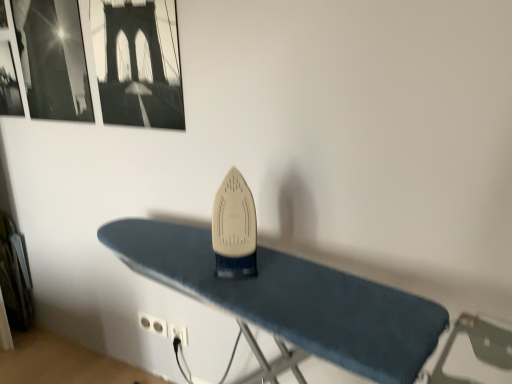
What do you see at coordinates (153, 324) in the screenshot?
I see `white plastic plug at lower center, marked as the 1th plug in a left-to-right arrangement` at bounding box center [153, 324].

At what (x,y) coordinates should I click in order to perform the action: click on white plastic plug at lower center, marked as the 1th plug in a left-to-right arrangement. Please return your answer as a coordinate pair (x, y). Looking at the image, I should click on (153, 324).

Locate an element on the screen. The image size is (512, 384). white plastic plug at lower center, marked as the 1th plug in a left-to-right arrangement is located at coordinates (153, 324).

From a real-world perspective, does black paper picture frame at upper left, arranged as the 2th picture frame when viewed from the left, stand above white plastic plug at lower center, marked as the 1th plug in a left-to-right arrangement?

Yes, from a real-world perspective, black paper picture frame at upper left, arranged as the 2th picture frame when viewed from the left, is over white plastic plug at lower center, marked as the 1th plug in a left-to-right arrangement

Which object is thinner, black paper picture frame at upper left, positioned as the 1th picture frame in right-to-left order, or white plastic plug at lower center, marked as the 1th plug in a left-to-right arrangement?

white plastic plug at lower center, marked as the 1th plug in a left-to-right arrangement.

Which object is more forward, black paper picture frame at upper left, arranged as the 2th picture frame when viewed from the left, or white plastic plug at lower center, the 2th plug viewed from the right?

black paper picture frame at upper left, arranged as the 2th picture frame when viewed from the left, is closer to the camera.

Can you tell me how much black paper picture frame at upper left, positioned as the 1th picture frame in right-to-left order, and white plastic plug at lower center, the 2th plug viewed from the right, differ in facing direction?

The angle between the facing direction of black paper picture frame at upper left, positioned as the 1th picture frame in right-to-left order, and the facing direction of white plastic plug at lower center, the 2th plug viewed from the right, is 0.00662 degrees.

Locate an element on the screen. The width and height of the screenshot is (512, 384). the 2nd picture frame to the left of the black plastic plug at lower center, which is the first plug in right-to-left order, starting your count from the anchor is located at coordinates (53, 59).

In terms of height, does black plastic plug at lower center, which is counted as the 2th plug, starting from the left, look taller or shorter compared to black glossy picture frame at upper left, the first picture frame when ordered from left to right?

Considering their sizes, black plastic plug at lower center, which is counted as the 2th plug, starting from the left, has less height than black glossy picture frame at upper left, the first picture frame when ordered from left to right.

From a real-world perspective, which object stands above the other?

black glossy picture frame at upper left, arranged as the 2th picture frame when viewed from the right, from a real-world perspective.

From the image's perspective, between black glossy picture frame at upper left, the first picture frame when ordered from left to right, and white plastic plug at lower center, marked as the 1th plug in a left-to-right arrangement, which one is located above?

black glossy picture frame at upper left, the first picture frame when ordered from left to right, is shown above in the image.

Which is more to the right, black glossy picture frame at upper left, arranged as the 2th picture frame when viewed from the right, or white plastic plug at lower center, marked as the 1th plug in a left-to-right arrangement?

Positioned to the right is white plastic plug at lower center, marked as the 1th plug in a left-to-right arrangement.

Between black glossy picture frame at upper left, the first picture frame when ordered from left to right, and white plastic plug at lower center, the 2th plug viewed from the right, which one has larger width?

black glossy picture frame at upper left, the first picture frame when ordered from left to right, is wider.

From a real-world perspective, which plug is the 2nd one underneath the black glossy picture frame at upper left, arranged as the 2th picture frame when viewed from the right? Please provide its 2D coordinates.

[(153, 324)]

Does white plastic plug at lower center, marked as the 1th plug in a left-to-right arrangement, have a larger size compared to white plastic iron at center?

No, white plastic plug at lower center, marked as the 1th plug in a left-to-right arrangement, is not bigger than white plastic iron at center.

Does white plastic plug at lower center, the 2th plug viewed from the right, touch white plastic iron at center?

white plastic plug at lower center, the 2th plug viewed from the right, and white plastic iron at center are clearly separated.

Which of these two, white plastic plug at lower center, marked as the 1th plug in a left-to-right arrangement, or white plastic iron at center, stands shorter?

white plastic plug at lower center, marked as the 1th plug in a left-to-right arrangement, is shorter.

Is white plastic plug at lower center, the 2th plug viewed from the right, in front of or behind white plastic iron at center in the image?

white plastic plug at lower center, the 2th plug viewed from the right, is positioned farther from the viewer than white plastic iron at center.

Would you consider white plastic iron at center to be distant from black glossy picture frame at upper left, arranged as the 2th picture frame when viewed from the right?

That's right, there is a large distance between white plastic iron at center and black glossy picture frame at upper left, arranged as the 2th picture frame when viewed from the right.

Where is `surfboard that is below the black glossy picture frame at upper left, the first picture frame when ordered from left to right (from the image's perspective)`? This screenshot has height=384, width=512. surfboard that is below the black glossy picture frame at upper left, the first picture frame when ordered from left to right (from the image's perspective) is located at coordinates (234, 228).

Based on the photo, does white plastic iron at center appear on the left side of black glossy picture frame at upper left, the first picture frame when ordered from left to right?

In fact, white plastic iron at center is to the right of black glossy picture frame at upper left, the first picture frame when ordered from left to right.

Considering the positions of point (71, 80) and point (175, 47), is point (71, 80) closer or farther from the camera than point (175, 47)?

Point (71, 80) is positioned farther from the camera compared to point (175, 47).

Which object is thinner, black glossy picture frame at upper left, the first picture frame when ordered from left to right, or black paper picture frame at upper left, positioned as the 1th picture frame in right-to-left order?

Thinner between the two is black paper picture frame at upper left, positioned as the 1th picture frame in right-to-left order.

Is the position of black glossy picture frame at upper left, arranged as the 2th picture frame when viewed from the right, more distant than that of black paper picture frame at upper left, positioned as the 1th picture frame in right-to-left order?

Yes, black glossy picture frame at upper left, arranged as the 2th picture frame when viewed from the right, is further from the viewer.

Is black glossy picture frame at upper left, the first picture frame when ordered from left to right, in contact with black paper picture frame at upper left, arranged as the 2th picture frame when viewed from the left?

There is a gap between black glossy picture frame at upper left, the first picture frame when ordered from left to right, and black paper picture frame at upper left, arranged as the 2th picture frame when viewed from the left.

From a real-world perspective, which is physically above, white plastic plug at lower center, the 2th plug viewed from the right, or blue fabric ironing board at center?

In real-world perspective, blue fabric ironing board at center is above.

Is white plastic plug at lower center, the 2th plug viewed from the right, positioned beyond the bounds of blue fabric ironing board at center?

white plastic plug at lower center, the 2th plug viewed from the right, is positioned outside blue fabric ironing board at center.

Looking at their sizes, would you say white plastic plug at lower center, marked as the 1th plug in a left-to-right arrangement, is wider or thinner than blue fabric ironing board at center?

Considering their sizes, white plastic plug at lower center, marked as the 1th plug in a left-to-right arrangement, looks slimmer than blue fabric ironing board at center.

Locate an element on the screen. This screenshot has width=512, height=384. the 2nd plug behind when counting from the black paper picture frame at upper left, positioned as the 1th picture frame in right-to-left order is located at coordinates (153, 324).

From the image's perspective, starting from the black plastic plug at lower center, which is the first plug in right-to-left order, which picture frame is the 2nd one above? Please provide its 2D coordinates.

[(53, 59)]

Estimate the real-world distances between objects in this image. Which object is closer to black paper picture frame at upper left, arranged as the 2th picture frame when viewed from the left, white plastic plug at lower center, the 2th plug viewed from the right, or blue fabric ironing board at center?

blue fabric ironing board at center is closer to black paper picture frame at upper left, arranged as the 2th picture frame when viewed from the left.

Looking at the image, which one is located further to black paper picture frame at upper left, arranged as the 2th picture frame when viewed from the left, blue fabric ironing board at center or black glossy picture frame at upper left, arranged as the 2th picture frame when viewed from the right?

The object further to black paper picture frame at upper left, arranged as the 2th picture frame when viewed from the left, is blue fabric ironing board at center.

Looking at the image, which one is located closer to white plastic iron at center, white plastic plug at lower center, marked as the 1th plug in a left-to-right arrangement, or blue fabric ironing board at center?

Among the two, blue fabric ironing board at center is located nearer to white plastic iron at center.

Considering their positions, is blue fabric ironing board at center positioned closer to white plastic plug at lower center, the 2th plug viewed from the right, than black glossy picture frame at upper left, the first picture frame when ordered from left to right?

Based on the image, blue fabric ironing board at center appears to be nearer to white plastic plug at lower center, the 2th plug viewed from the right.

From the image, which object appears to be nearer to black glossy picture frame at upper left, arranged as the 2th picture frame when viewed from the right, white plastic plug at lower center, marked as the 1th plug in a left-to-right arrangement, or white plastic iron at center?

white plastic iron at center is positioned closer to the anchor black glossy picture frame at upper left, arranged as the 2th picture frame when viewed from the right.

Based on their spatial positions, is white plastic plug at lower center, the 2th plug viewed from the right, or black paper picture frame at upper left, positioned as the 1th picture frame in right-to-left order, further from white plastic iron at center?

white plastic plug at lower center, the 2th plug viewed from the right, lies further to white plastic iron at center than the other object.

When comparing their distances from black glossy picture frame at upper left, arranged as the 2th picture frame when viewed from the right, does black paper picture frame at upper left, arranged as the 2th picture frame when viewed from the left, or black plastic plug at lower center, which is the first plug in right-to-left order, seem further?

black plastic plug at lower center, which is the first plug in right-to-left order, is further to black glossy picture frame at upper left, arranged as the 2th picture frame when viewed from the right.

Looking at this image, when comparing their distances from blue fabric ironing board at center, does black glossy picture frame at upper left, the first picture frame when ordered from left to right, or white plastic plug at lower center, the 2th plug viewed from the right, seem closer?

black glossy picture frame at upper left, the first picture frame when ordered from left to right.

This screenshot has width=512, height=384. I want to click on picture frame between black glossy picture frame at upper left, arranged as the 2th picture frame when viewed from the right, and black plastic plug at lower center, which is the first plug in right-to-left order, in the vertical direction, so click(138, 62).

At what (x,y) coordinates should I click in order to perform the action: click on picture frame between black glossy picture frame at upper left, the first picture frame when ordered from left to right, and blue fabric ironing board at center from top to bottom. Please return your answer as a coordinate pair (x, y). The width and height of the screenshot is (512, 384). Looking at the image, I should click on (138, 62).

I want to click on plug located between blue fabric ironing board at center and white plastic plug at lower center, the 2th plug viewed from the right, in the depth direction, so click(x=178, y=333).

Locate an element on the screen. This screenshot has height=384, width=512. surfboard between black glossy picture frame at upper left, the first picture frame when ordered from left to right, and white plastic plug at lower center, marked as the 1th plug in a left-to-right arrangement, from top to bottom is located at coordinates click(234, 228).